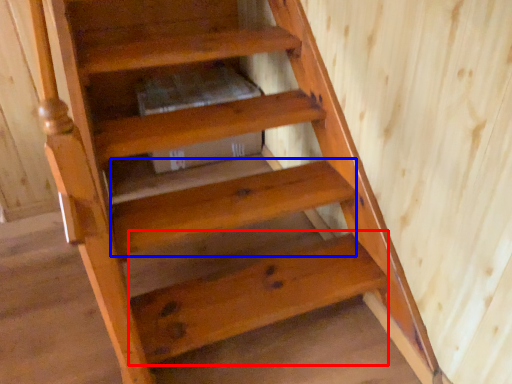
Question: Which object is further to the camera taking this photo, stairwell (highlighted by a red box) or stairwell (highlighted by a blue box)?

Choices:
 (A) stairwell
 (B) stairwell

Answer: (B)